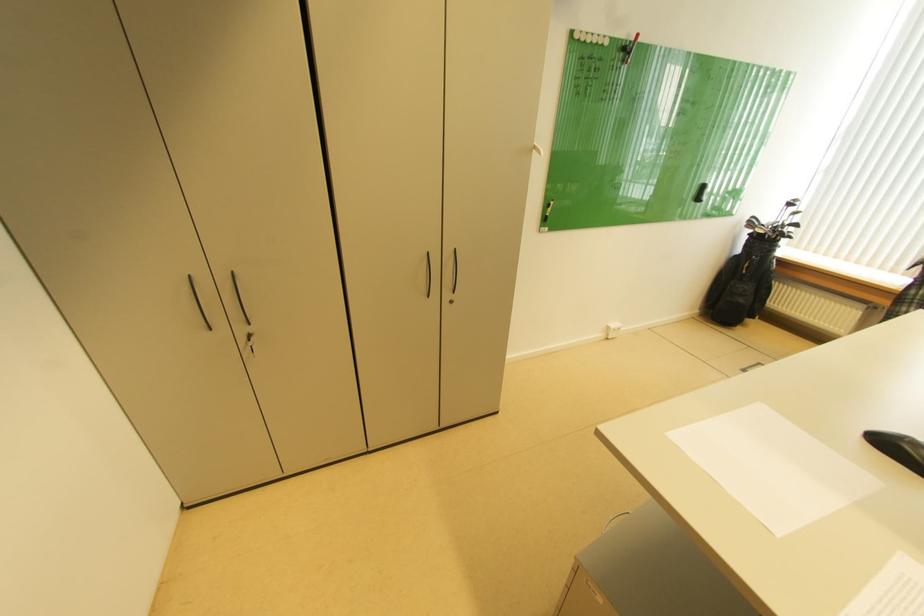
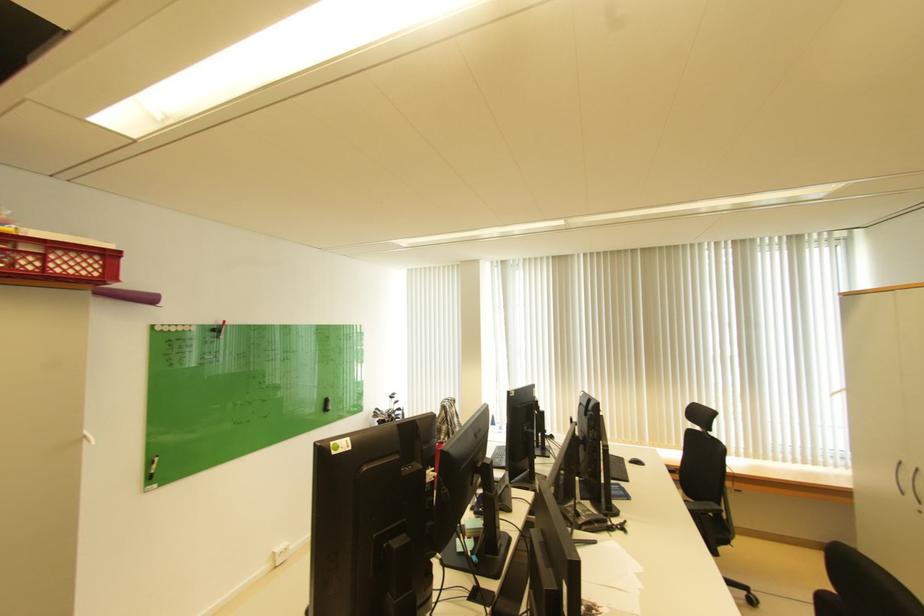
Locate, in the second image, the point that corresponds to the point at 651,209 in the first image.

(323, 411)